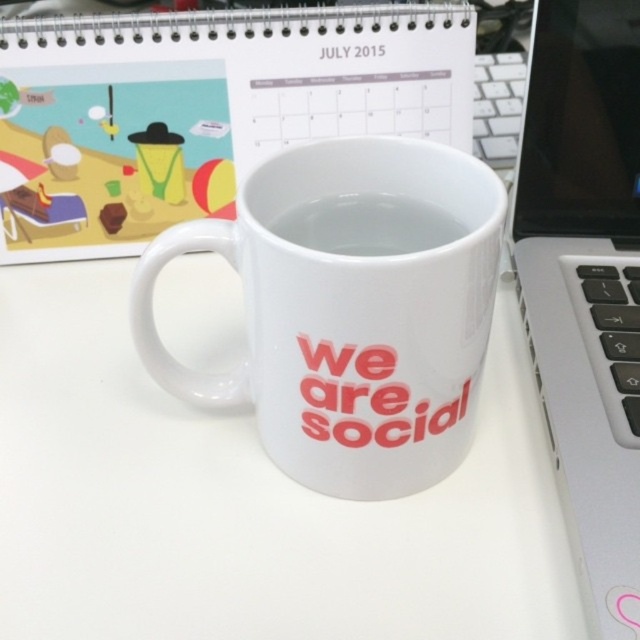
You are setting up a workspace and need to place a small plant between the white glossy table at center and the silver metallic laptop at right. Which object should the plant be closer to based on their heights?

The white glossy table at center is not as tall as the silver metallic laptop at right, so the plant should be placed closer to the white glossy table at center to ensure it is visible from both objects.

You are organizing your desk and want to place a new item between the white glossy table at center and the silver metallic laptop at right. Is there enough space for it?

The white glossy table at center is to the left of the silver metallic laptop at right, so there is space between them for placing a new item.